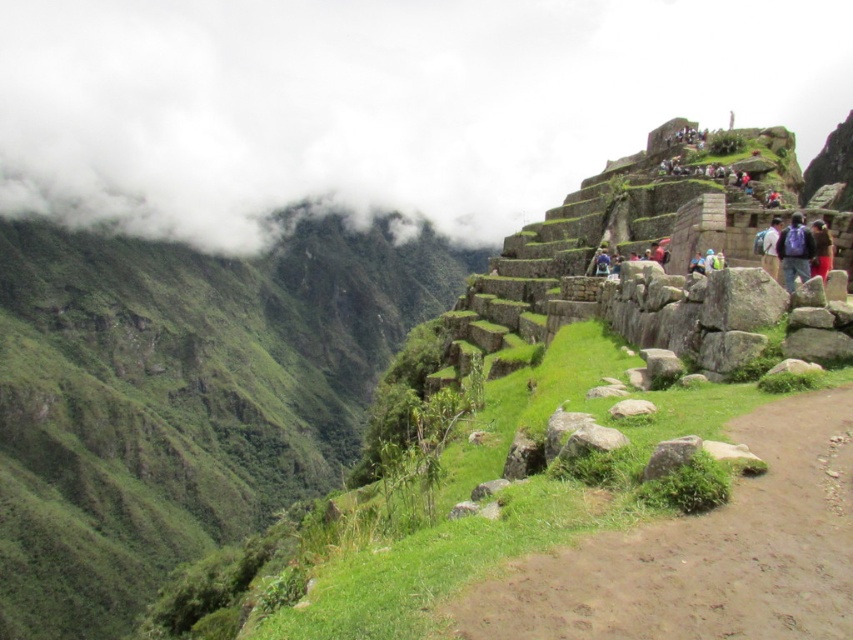
From the picture: You are a photographer standing at the entrance of Machu Picchu, holding a camera with a 50mm lens. You want to capture the white fluffy cloud at upper left in your photo. Considering the cloud is 58.05 meters away, will the cloud be in focus if your camera is set to a hyperfocal distance of 50 meters?

The white fluffy cloud at upper left is 58.05 meters away. Since the hyperfocal distance is set to 50 meters, any object beyond half of that distance will be in focus. Half of 50 meters is 25 meters, so anything beyond 25 meters should be in focus. Therefore, the cloud at 58.05 meters will be in focus.

You are a tourist at Machu Picchu and want to take a photo that includes both the white fluffy cloud at upper left and the brown dirt path at center. Which object should you position closer to the left side of the frame to ensure both are visible?

To include both the white fluffy cloud at upper left and the brown dirt path at center in your photo, position the brown dirt path at center closer to the left side of the frame because the white fluffy cloud at upper left is to the right of it.

You are standing at the entrance of Machu Picchu and see two points marked on the ground. One is at point coordinates point (844, 68) and the other is at point (611, 554). Which point is closer to you?

Point (844, 68) is further to the camera than point (611, 554), so the point closer to you is point (611, 554).